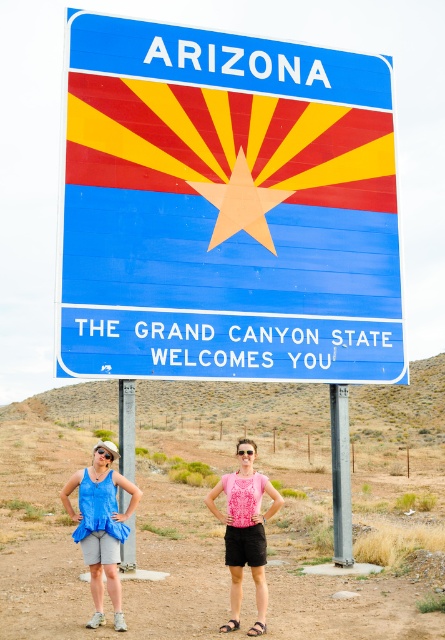
You are a photographer taking a picture of the blue fabric tank top at center and the blue painted sign at center. Which object is closer to the camera?

Result: The blue fabric tank top at center is closer to the camera because the blue painted sign at center is positioned over it, indicating it is behind.